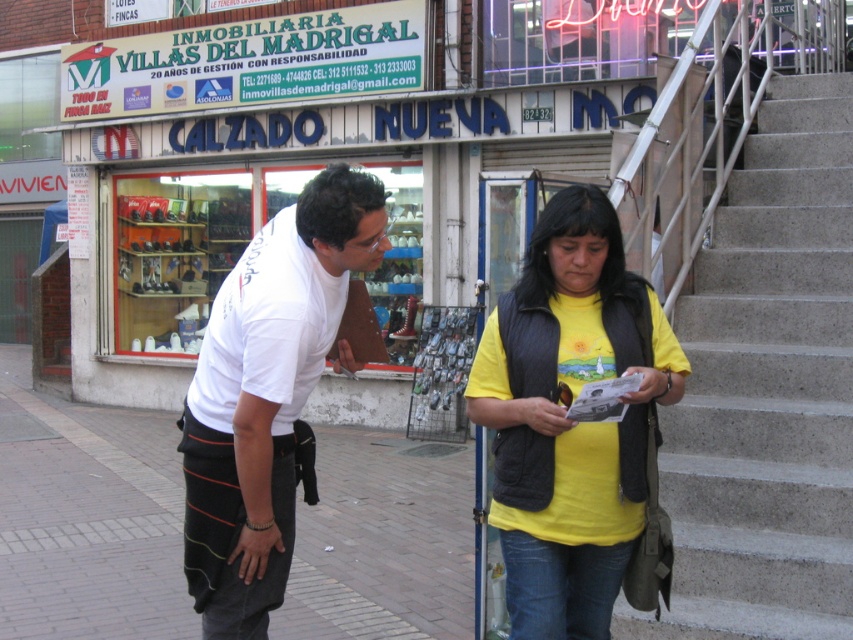
Question: Which object is positioned closest to the white cotton t-shirt at center?

Choices:
 (A) yellow matte vest at center
 (B) concrete stairs at right
 (C) brick pavement at lower left

Answer: (A)

Question: Which of the following is the closest to the observer?

Choices:
 (A) white fabric shirt at center
 (B) concrete stairs at right
 (C) yellow matte vest at center
 (D) white cotton t-shirt at center

Answer: (C)

Question: Does white fabric shirt at center appear over white cotton t-shirt at center?

Choices:
 (A) yes
 (B) no

Answer: (B)

Question: Is concrete stairs at right to the right of brick pavement at lower left from the viewer's perspective?

Choices:
 (A) no
 (B) yes

Answer: (B)

Question: Which point is farther to the camera?

Choices:
 (A) (294, 360)
 (B) (544, 225)
 (C) (750, 580)

Answer: (C)

Question: Is yellow matte vest at center behind white cotton t-shirt at center?

Choices:
 (A) no
 (B) yes

Answer: (A)